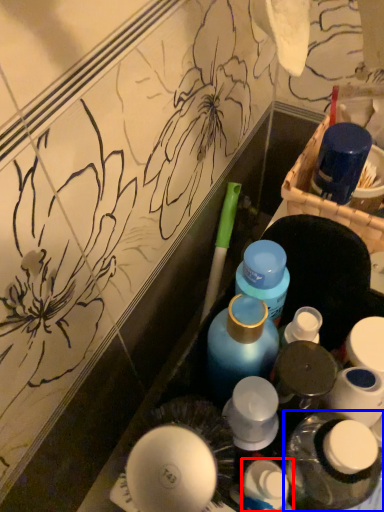
Question: Which object appears farthest to the camera in this image, toiletry (highlighted by a red box) or bottle (highlighted by a blue box)?

Choices:
 (A) toiletry
 (B) bottle

Answer: (A)